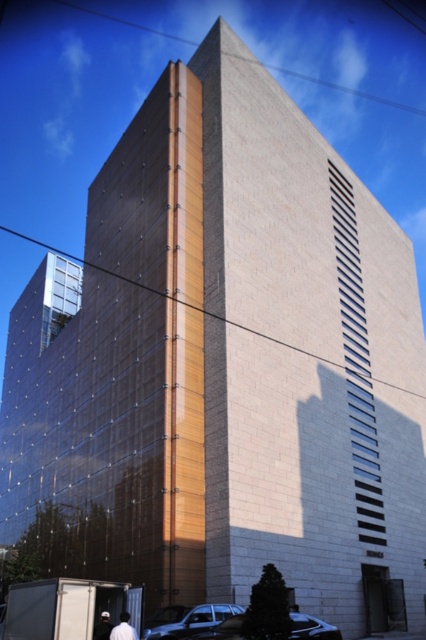
Question: Which point is closer to the camera?

Choices:
 (A) shiny silver car at lower center
 (B) white cotton shirt at lower left
 (C) white cotton cap at lower left

Answer: (B)

Question: Observing the image, what is the correct spatial positioning of metallic silver car at lower center in reference to shiny silver car at lower center?

Choices:
 (A) left
 (B) right

Answer: (A)

Question: Considering the real-world distances, which object is farthest from the white matte person at lower center?

Choices:
 (A) metallic silver car at lower center
 (B) white cotton shirt at lower left
 (C) shiny silver car at lower center

Answer: (B)

Question: Which of the following is the closest to the observer?

Choices:
 (A) (233, 604)
 (B) (324, 628)
 (C) (106, 618)
 (D) (293, 609)

Answer: (C)

Question: Does metallic silver car at lower center have a larger size compared to shiny silver car at lower center?

Choices:
 (A) yes
 (B) no

Answer: (B)

Question: Does shiny silver car at lower center appear on the right side of white cotton cap at lower left?

Choices:
 (A) no
 (B) yes

Answer: (B)